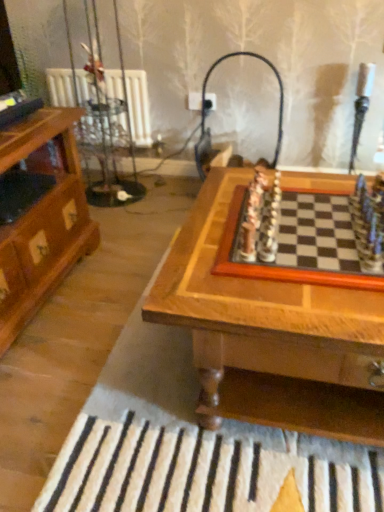
Question: From the image's perspective, is wooden chessboard at center positioned above or below matte black lamp at upper center?

Choices:
 (A) above
 (B) below

Answer: (B)

Question: Looking at the image, does wooden chessboard at center seem bigger or smaller compared to matte black lamp at upper center?

Choices:
 (A) big
 (B) small

Answer: (B)

Question: Which of these objects is positioned farthest from the matte black lamp at upper center?

Choices:
 (A) wooden chessboard at center
 (B) wooden chessboard at center

Answer: (A)

Question: Which object is the closest to the wooden chessboard at center?

Choices:
 (A) matte black lamp at upper center
 (B) wooden chessboard at center

Answer: (B)